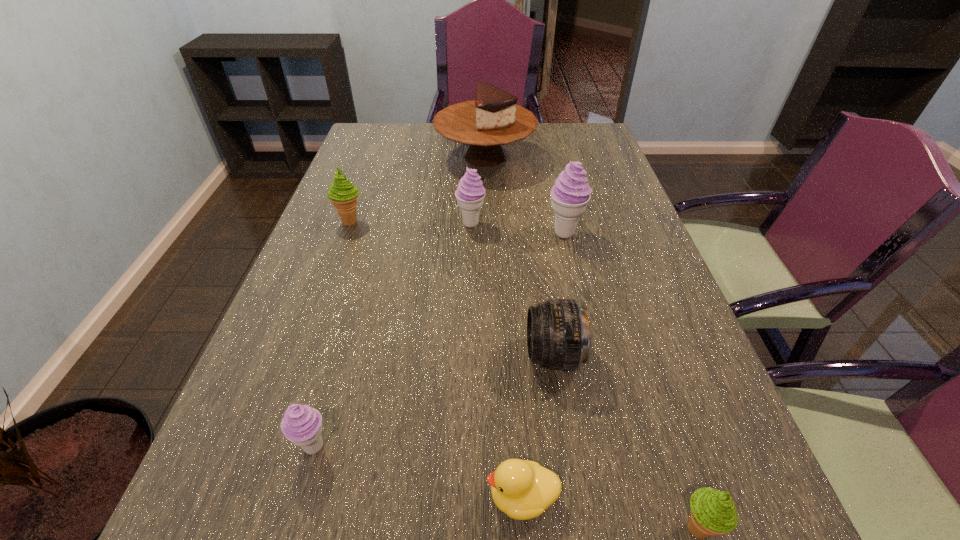
Locate an element on the screen. vacant space situated 0.370m on the back of the second icecream from left to right is located at coordinates (361, 282).

The width and height of the screenshot is (960, 540). Identify the location of blank space located 0.300m on the beak of the yellow duckling. (291, 496).

Identify the location of vacant position located on the beak of the yellow duckling. The height and width of the screenshot is (540, 960). (239, 496).

Where is `free region located on the beak of the yellow duckling`? The height and width of the screenshot is (540, 960). free region located on the beak of the yellow duckling is located at coordinates (252, 496).

You are a GUI agent. You are given a task and a screenshot of the screen. Output one action in this format:
    pyautogui.click(x=<x>, y=<y>)
    Task: Click on the object that is at the far edge
    
    Given the screenshot: What is the action you would take?
    pyautogui.click(x=493, y=119)

Find the location of a particular element. The width and height of the screenshot is (960, 540). object located in the right edge section of the desktop is located at coordinates (571, 193).

Locate an element on the screen. vacant region at the far edge of the desktop is located at coordinates (537, 151).

Locate an element on the screen. The image size is (960, 540). vacant space at the left edge is located at coordinates (385, 161).

You are a GUI agent. You are given a task and a screenshot of the screen. Output one action in this format:
    pyautogui.click(x=<x>, y=<y>)
    Task: Click on the vacant space at the right edge of the desktop
    This screenshot has width=960, height=540.
    Given the screenshot: What is the action you would take?
    pyautogui.click(x=622, y=181)

This screenshot has height=540, width=960. I want to click on vacant space at the far right corner, so click(597, 140).